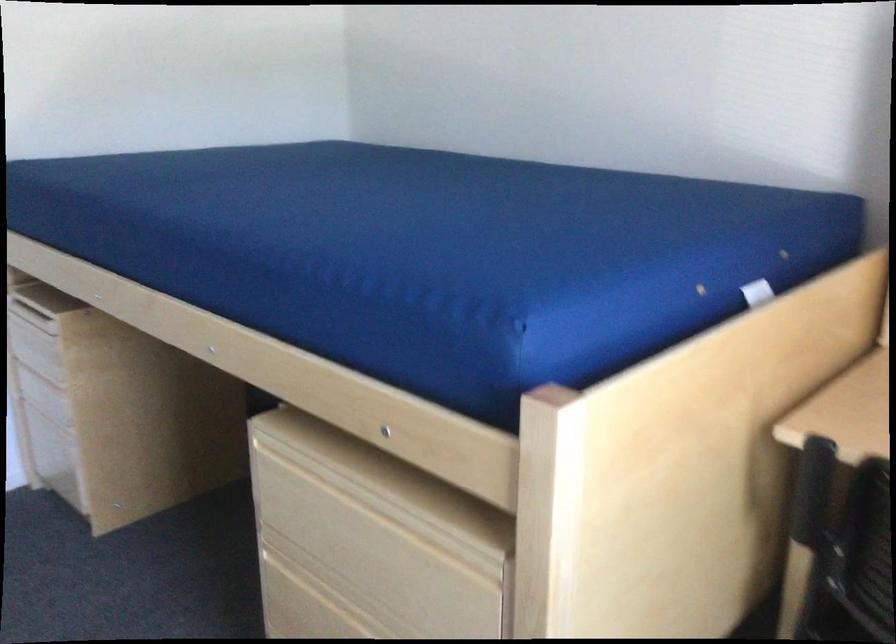
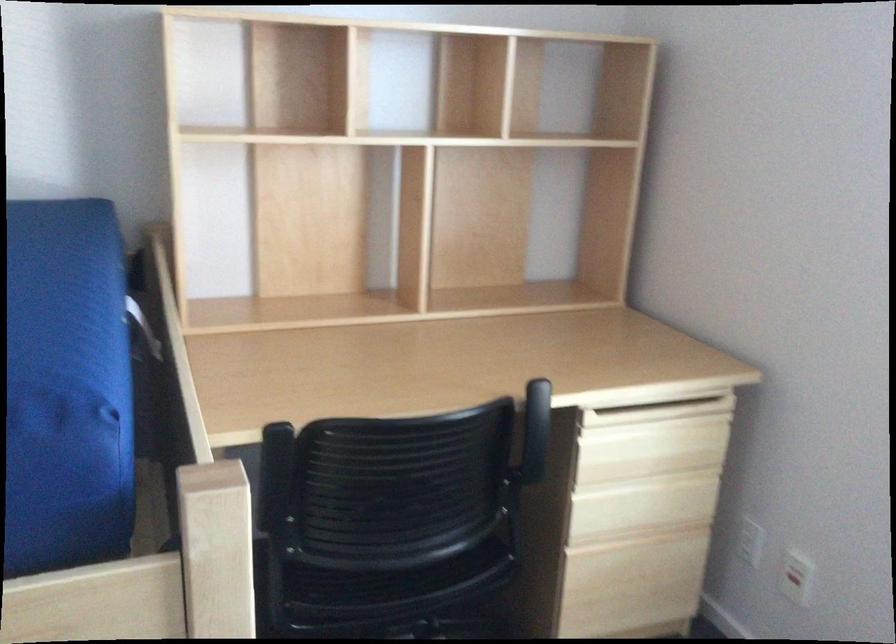
Question: The camera is either moving clockwise (left) or counter-clockwise (right) around the object. The first image is from the beginning of the video and the second image is from the end. Is the camera moving left or right when shooting the video?

Choices:
 (A) Left
 (B) Right

Answer: (A)